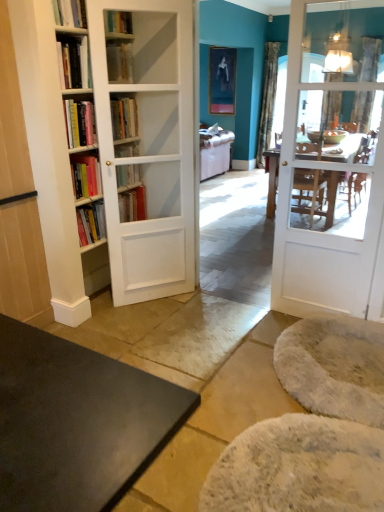
Where is `vacant space that is in between white glossy bookcase at left and gray fuzzy yoga mat at lower right, which appears as the 2th yoga mat when viewed from the back`? This screenshot has height=512, width=384. vacant space that is in between white glossy bookcase at left and gray fuzzy yoga mat at lower right, which appears as the 2th yoga mat when viewed from the back is located at coordinates (191, 359).